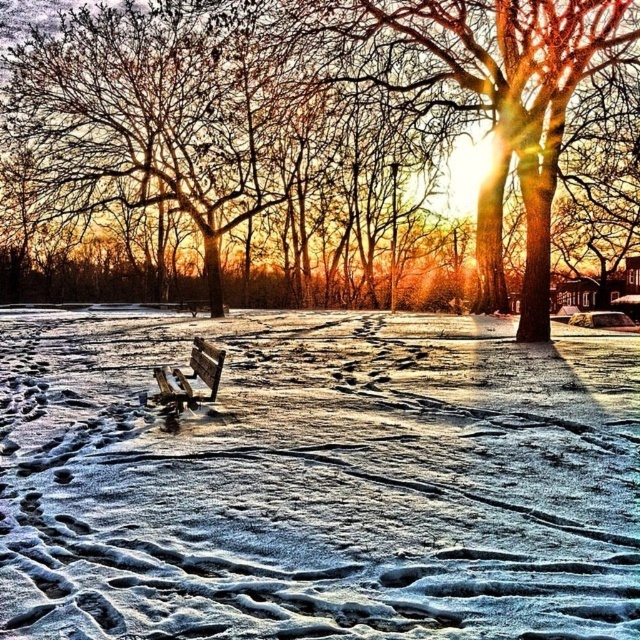
Is white frosty snow at center thinner than wooden park bench at center?

No.

Is point (500, 570) positioned behind point (209, 356)?

No, it is not.

At what (x,y) coordinates should I click in order to perform the action: click on white frosty snow at center. Please return your answer as a coordinate pair (x, y). Looking at the image, I should click on (317, 480).

Which is above, white frosty snow at center or brown textured tree at center?

Positioned higher is brown textured tree at center.

Can you confirm if white frosty snow at center is smaller than brown textured tree at center?

Correct, white frosty snow at center occupies less space than brown textured tree at center.

Does point (538, 481) come closer to viewer compared to point (252, 4)?

That is True.

Find the location of `white frosty snow at center`. white frosty snow at center is located at coordinates (317, 480).

Which is in front, point (224, 131) or point (182, 403)?

Point (182, 403) is more forward.

From the picture: Is brown textured tree at center positioned in front of wooden park bench at center?

No, it is not.

Describe the element at coordinates (326, 140) in the screenshot. The image size is (640, 640). I see `brown textured tree at center` at that location.

Image resolution: width=640 pixels, height=640 pixels. Find the location of `brown textured tree at center`. brown textured tree at center is located at coordinates (326, 140).